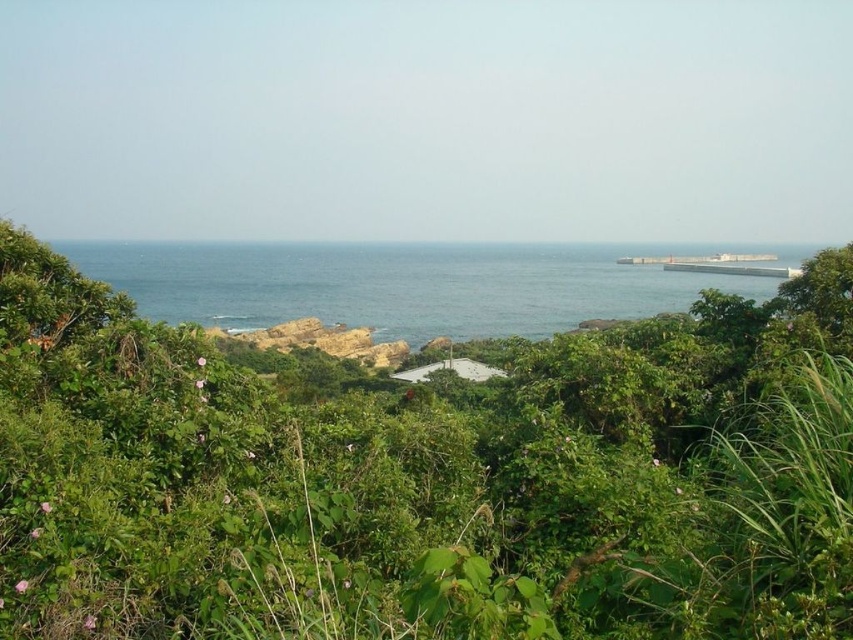
You are standing at the point with coordinates point (x=563, y=278) and want to walk towards the ocean. There is an obstacle at point (x=173, y=436). Will you encounter this obstacle before reaching the ocean?

Point (x=173, y=436) is in front of point (x=563, y=278), so yes, you will encounter the obstacle at point (x=173, y=436) before reaching the ocean.

You are standing at the edge of the coastal landscape and want to take a photo of the green leafy bush at center and the blue water at center. Based on their positions, which object will appear closer to the camera in the photo?

The green leafy bush at center will appear closer to the camera in the photo because it is positioned in front of the blue water at center.